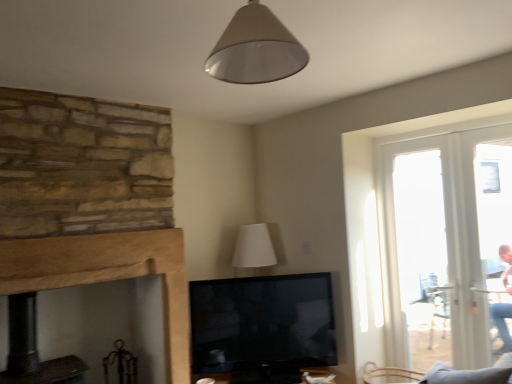
At what (x,y) coordinates should I click in order to perform the action: click on free spot above wooden mantle at center (from a real-world perspective). Please return your answer as a coordinate pair (x, y). The height and width of the screenshot is (384, 512). Looking at the image, I should click on 94,234.